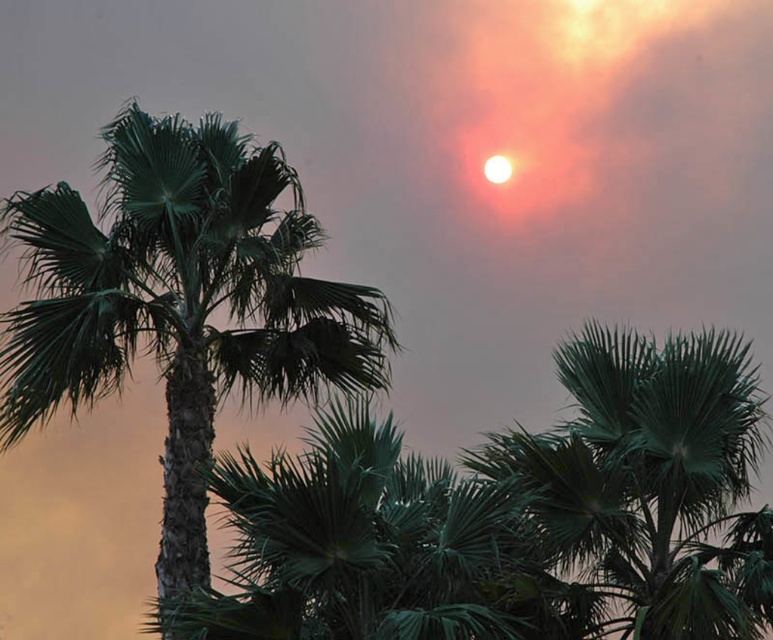
Can you confirm if green leafy palm tree at center is positioned to the right of green leafy palm tree at upper center?

In fact, green leafy palm tree at center is to the left of green leafy palm tree at upper center.

The image size is (773, 640). What do you see at coordinates (179, 301) in the screenshot?
I see `green leafy palm tree at center` at bounding box center [179, 301].

Find the location of a particular element. Image resolution: width=773 pixels, height=640 pixels. green leafy palm tree at center is located at coordinates (179, 301).